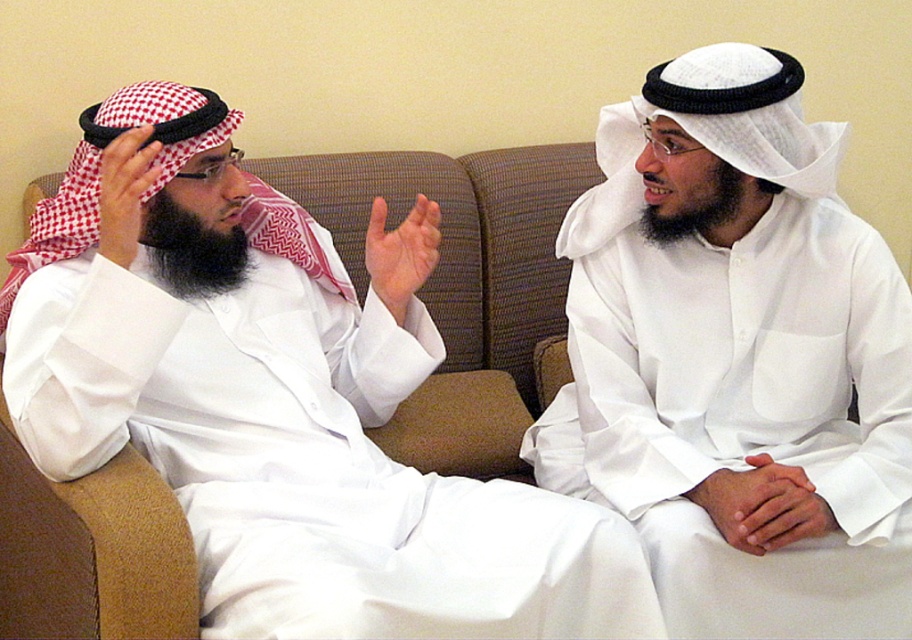
Question: Does white matte/soft fabric at left appear on the right side of smooth white hands at center?

Choices:
 (A) no
 (B) yes

Answer: (A)

Question: Is smooth white hands at center wider than matte white hand at center?

Choices:
 (A) no
 (B) yes

Answer: (B)

Question: Which object is farther from the camera taking this photo?

Choices:
 (A) white checkered cloth at upper left
 (B) white matte/soft fabric at left
 (C) matte white hand at center

Answer: (C)

Question: Can you confirm if smooth white hands at center is positioned to the right of white checkered cloth at upper left?

Choices:
 (A) yes
 (B) no

Answer: (A)

Question: Which of these objects is positioned closest to the white matte/soft fabric at left?

Choices:
 (A) matte white hand at center
 (B) smooth white hands at center

Answer: (A)

Question: Which object appears closest to the camera in this image?

Choices:
 (A) white matte/soft fabric at left
 (B) matte white hand at center
 (C) white checkered cloth at upper left

Answer: (A)